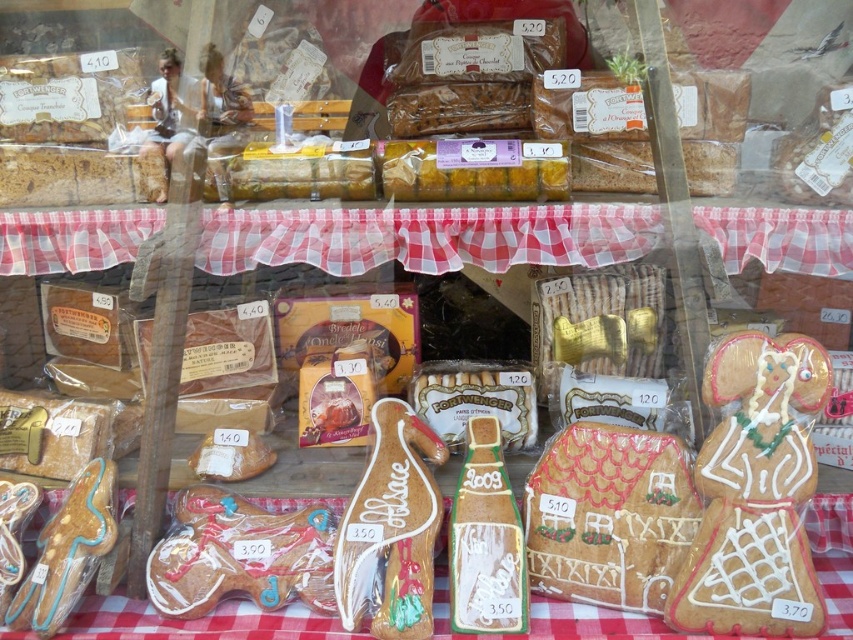
Does white frosted gingerbread house at center have a larger size compared to matte brown gingerbread man at lower left?

Indeed, white frosted gingerbread house at center has a larger size compared to matte brown gingerbread man at lower left.

The image size is (853, 640). I want to click on white frosted gingerbread house at center, so click(608, 515).